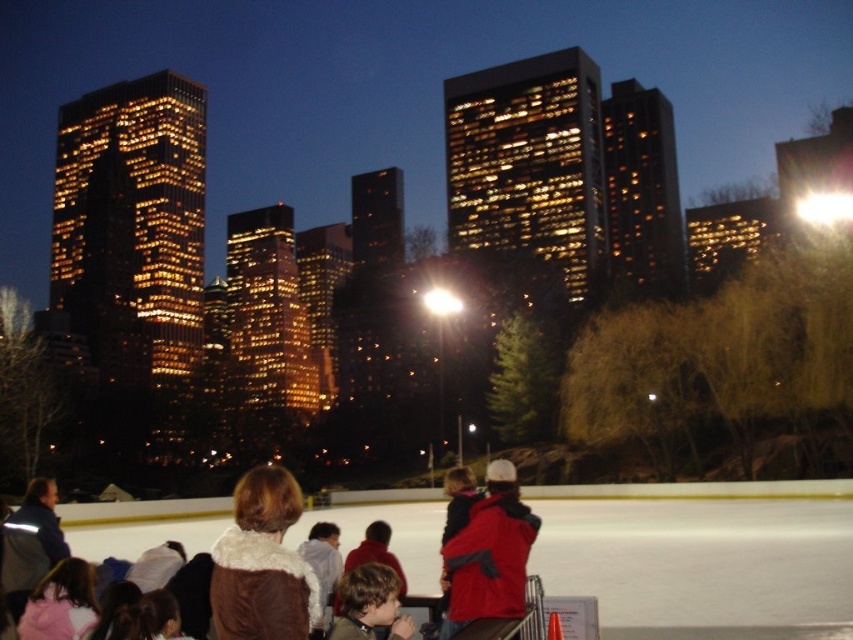
You are standing at the edge of the ice skating rink and see both the brown fur coat at center and the red matte jacket at center. Which one is nearer to you?

The brown fur coat at center is closer to the viewer than the red matte jacket at center, so the brown fur coat at center is nearer to you.

You are a photographer trying to capture a photo of the brown fur coat at center and the brown fuzzy jacket at lower center. If you want both subjects to be fully visible in the frame without cropping, which one might require you to adjust your camera angle to accommodate its width?

The brown fur coat at center might be wider than the brown fuzzy jacket at lower center, so you might need to adjust the camera angle to include the full width of the brown fur coat at center.

You are standing at the entrance of the ice skating rink and want to greet a friend wearing a brown fur coat at center and a brown fuzzy jacket at lower center. Which piece of clothing should you look for first to locate them?

A: You should look for the brown fur coat at center first because it is closer to you than the brown fuzzy jacket at lower center, making it more visible.